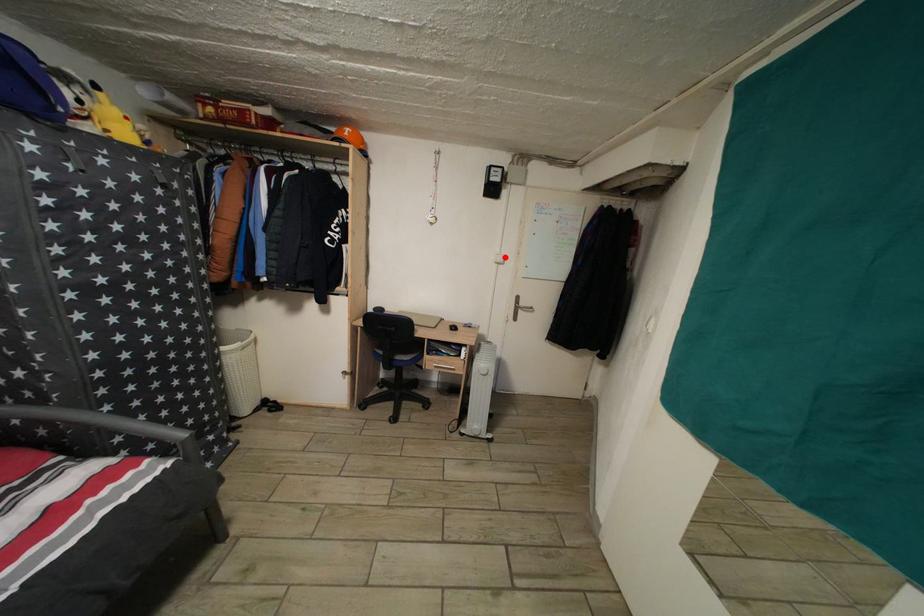
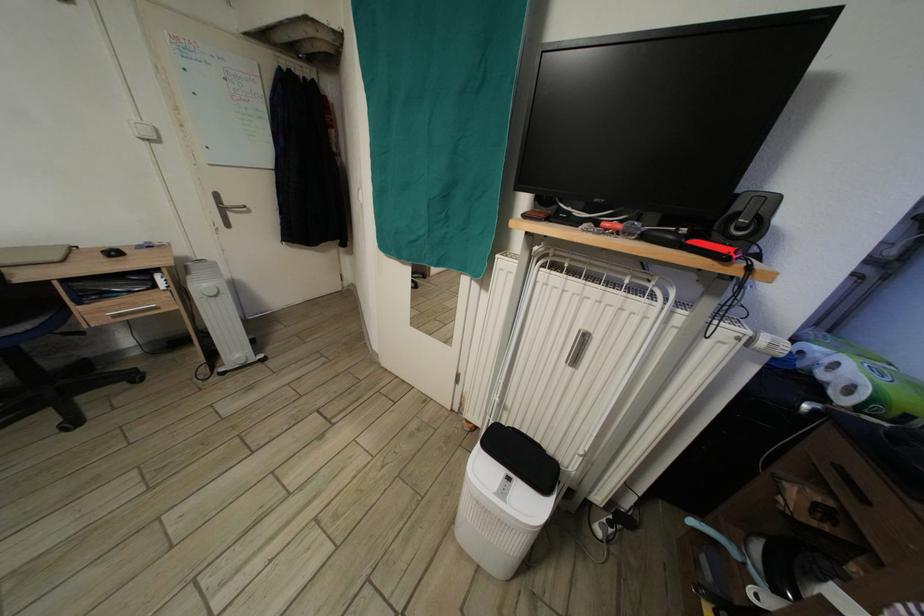
Where in the second image is the point corresponding to the highlighted location from the first image?

(141, 124)